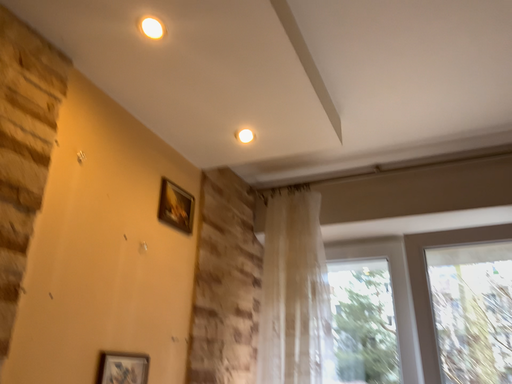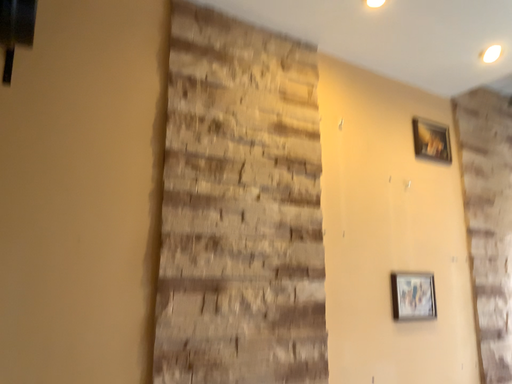
Question: Which way did the camera rotate in the video?

Choices:
 (A) rotated upward
 (B) rotated downward

Answer: (B)